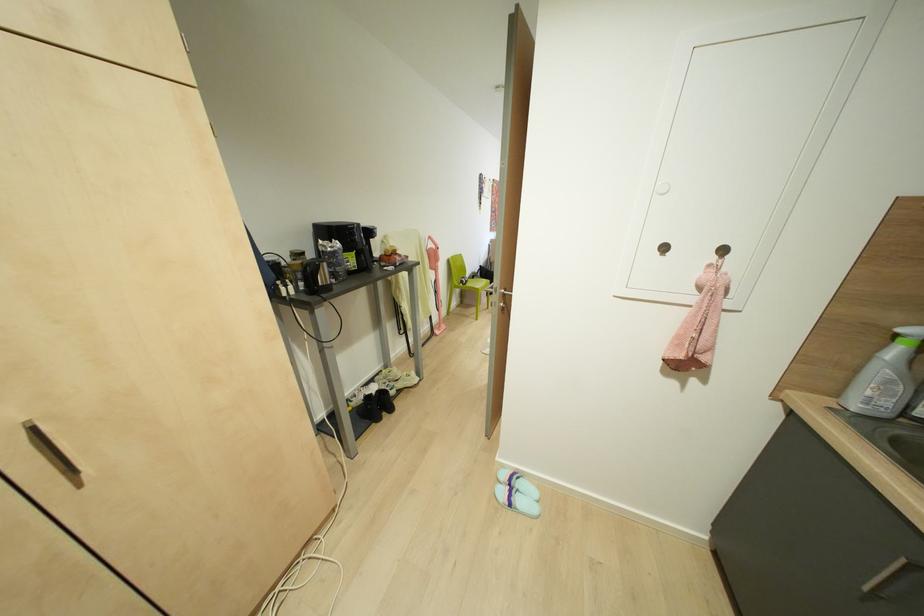
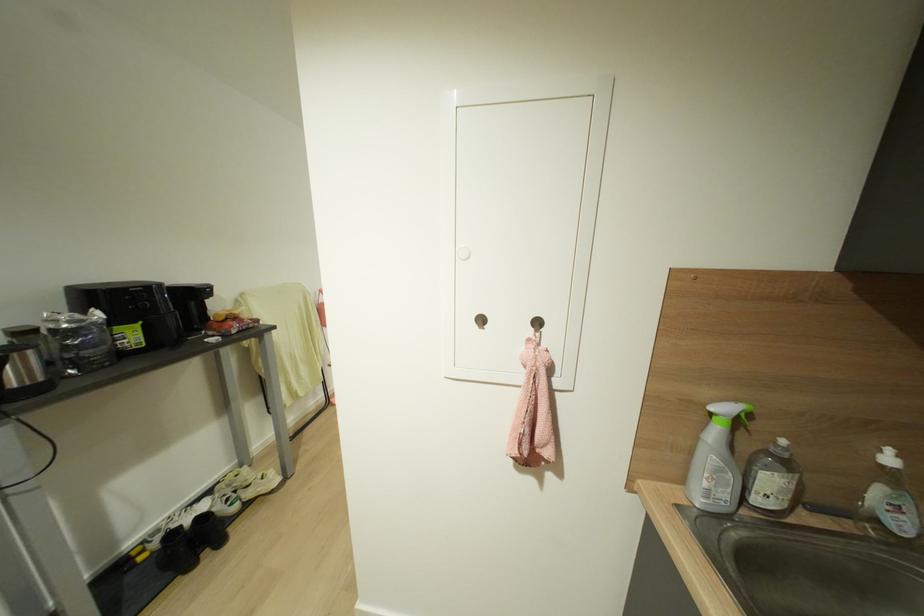
Question: How did the camera likely rotate?

Choices:
 (A) Left
 (B) Right
 (C) Up
 (D) Down

Answer: (B)